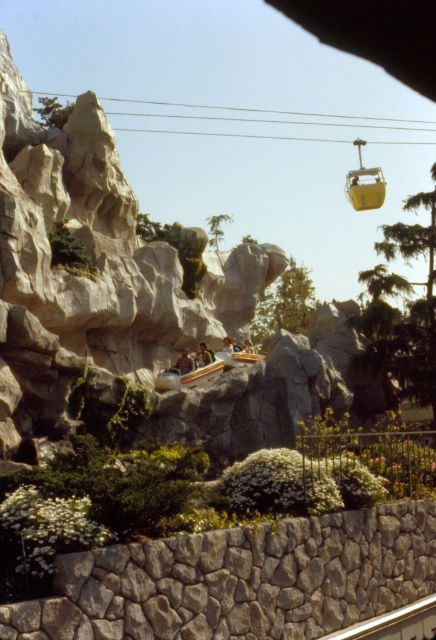
You are standing at the point with coordinates point (x=176, y=365) and want to walk to the point with coordinates point (x=225, y=360). According to the scene description, will the path between these two points be blocked by the stone wall or the bushes?

The point (x=225, y=360) is behind point (x=176, y=365), so the path between them would be blocked by the stone wall or bushes in front of it.

In the scene shown: You are standing at the center of the image. Which direction should you look to see the yellow matte ski lift at upper right?

You should look to the upper right direction to see the yellow matte ski lift at upper right since it is located at point (364, 182).

You are standing at the base of the stone wall and want to place the brown leather jacket at center so it can be seen from the yellow matte ski lift at upper right. Is the jacket visible from the ski lift?

The yellow matte ski lift at upper right might be wider than brown leather jacket at center, but visibility depends on factors like elevation and obstruction. Since the jacket is at center and the lift is at upper right, it could potentially be seen if there are no obstructions between them.